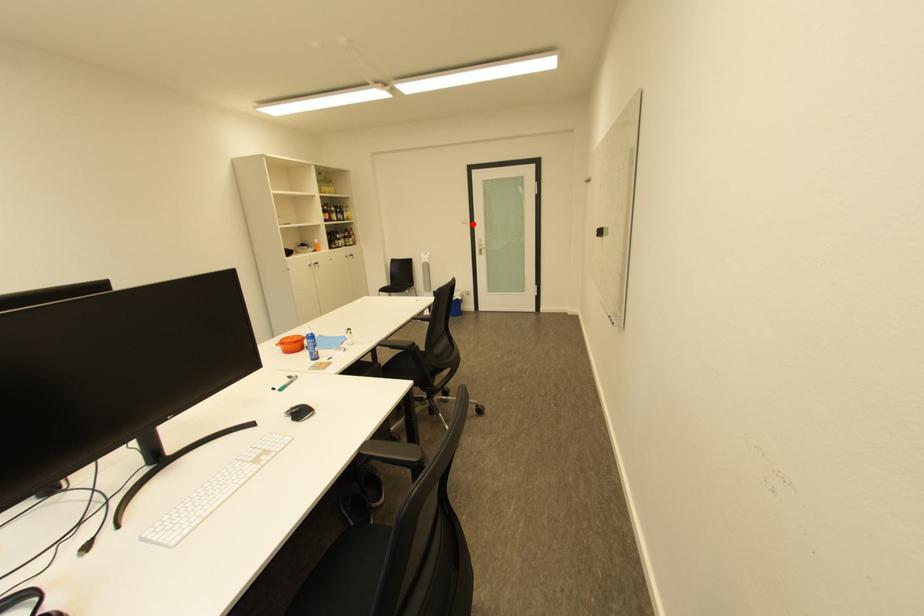
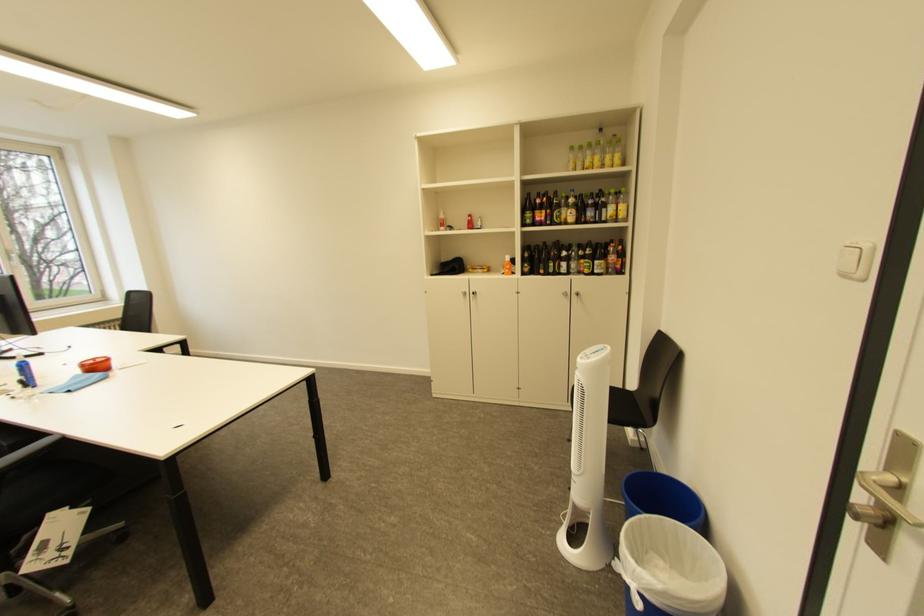
The point at the highlighted location is marked in the first image. Where is the corresponding point in the second image?

(855, 277)